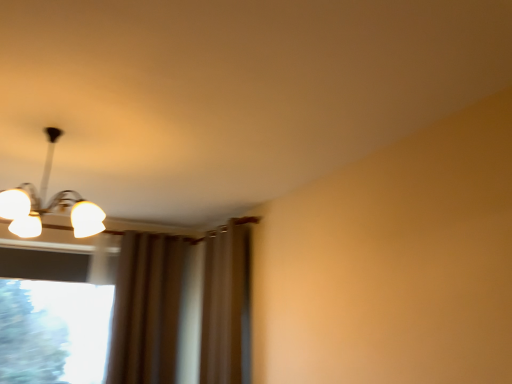
Question: Is point (41, 200) closer or farther from the camera than point (58, 314)?

Choices:
 (A) closer
 (B) farther

Answer: (A)

Question: Based on their sizes in the image, would you say white glossy light fixture at upper left is bigger or smaller than transparent glass window at lower left?

Choices:
 (A) small
 (B) big

Answer: (A)

Question: Which is nearer to the transparent glass window at lower left?

Choices:
 (A) white glossy light fixture at upper left
 (B) brown fabric curtain at center

Answer: (A)

Question: Estimate the real-world distances between objects in this image. Which object is closer to the transparent glass window at lower left?

Choices:
 (A) white glossy light fixture at upper left
 (B) brown fabric curtain at center

Answer: (A)